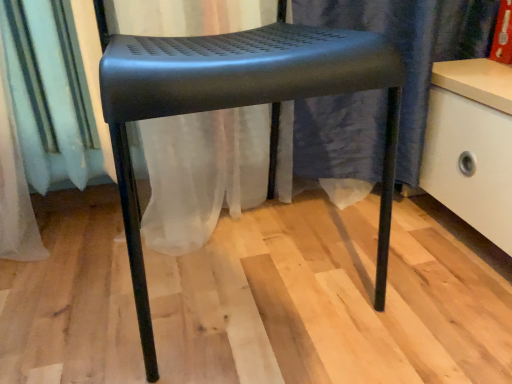
Locate an element on the screen. This screenshot has height=384, width=512. vacant space to the left of matte black stool at center is located at coordinates (68, 295).